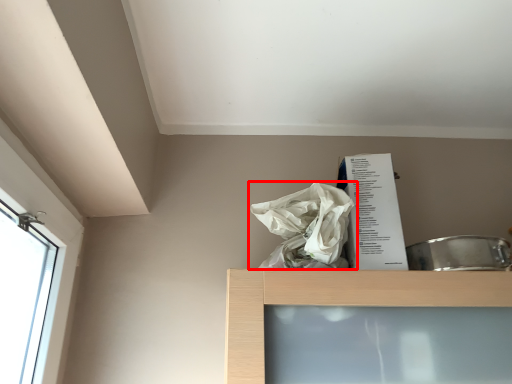
Question: From the image's perspective, what is the correct spatial relationship of plastic bag (annotated by the red box) in relation to paperback book?

Choices:
 (A) below
 (B) above

Answer: (B)